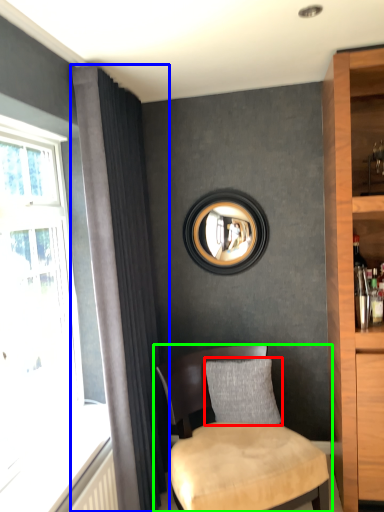
Question: Considering the real-world distances, which object is farthest from pillow (highlighted by a red box)? curtain (highlighted by a blue box) or chair (highlighted by a green box)?

Choices:
 (A) curtain
 (B) chair

Answer: (A)